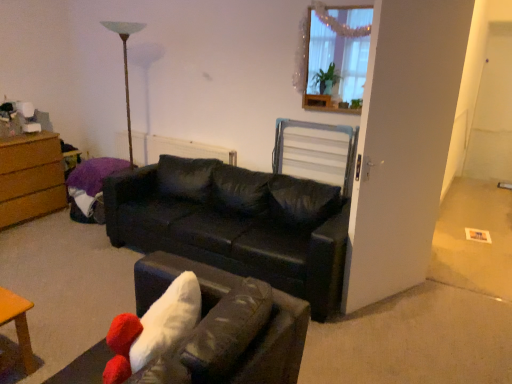
The width and height of the screenshot is (512, 384). What do you see at coordinates (334, 57) in the screenshot?
I see `wooden frame at upper right` at bounding box center [334, 57].

I want to click on white textured radiator at center, so click(x=175, y=149).

Looking at this image, measure the distance between point (274, 284) and camera.

Point (274, 284) is 8.61 feet from camera.

What do you see at coordinates (30, 177) in the screenshot?
I see `brown wood chest of drawers at left` at bounding box center [30, 177].

Image resolution: width=512 pixels, height=384 pixels. I want to click on metallic silver swivel chair at center, so click(315, 151).

Where is `wooden frame at upper right`? wooden frame at upper right is located at coordinates (334, 57).

Consider the image. Would you say white textured radiator at center contains wooden frame at upper right?

Actually, wooden frame at upper right is outside white textured radiator at center.

Between white textured radiator at center and wooden frame at upper right, which one has smaller size?

With smaller size is wooden frame at upper right.

Identify the location of window in front of the white textured radiator at center. Image resolution: width=512 pixels, height=384 pixels. (334, 57).

Are white textured radiator at center and wooden frame at upper right far apart?

Yes, white textured radiator at center and wooden frame at upper right are located far from each other.

From the image's perspective, which one is positioned lower, brown wood chest of drawers at left or metallic silver swivel chair at center?

brown wood chest of drawers at left appears lower in the image.

Based on the photo, based on their positions, is brown wood chest of drawers at left located to the left or right of metallic silver swivel chair at center?

brown wood chest of drawers at left is to the left of metallic silver swivel chair at center.

In the scene shown: Who is more distant, brown wood chest of drawers at left or metallic silver swivel chair at center?

brown wood chest of drawers at left is behind.

How distant is brown wood chest of drawers at left from metallic silver swivel chair at center?

The distance of brown wood chest of drawers at left from metallic silver swivel chair at center is 7.41 feet.

From the image's perspective, is metallic silver swivel chair at center above or below black leather couch at center, the 2th studio couch in the front-to-back sequence?

metallic silver swivel chair at center is situated higher than black leather couch at center, the 2th studio couch in the front-to-back sequence, in the image.

This screenshot has height=384, width=512. Identify the location of swivel chair that appears behind the black leather couch at center, the first studio couch viewed from the back. (315, 151).

Measure the distance from metallic silver swivel chair at center to black leather couch at center, the first studio couch viewed from the back.

metallic silver swivel chair at center is 27.36 inches away from black leather couch at center, the first studio couch viewed from the back.

You are a GUI agent. You are given a task and a screenshot of the screen. Output one action in this format:
    pyautogui.click(x=<x>, y=<y>)
    Task: Click on the studio couch that is the 1st object directly below the wooden frame at upper right (from a real-world perspective)
    The image size is (512, 384).
    Given the screenshot: What is the action you would take?
    pyautogui.click(x=273, y=346)

Are black leather couch at center, acting as the 2th studio couch starting from the back, and wooden frame at upper right far apart?

Indeed, black leather couch at center, acting as the 2th studio couch starting from the back, is not near wooden frame at upper right.

From a real-world perspective, which is physically below, black leather couch at center, the first studio couch from the front, or wooden frame at upper right?

black leather couch at center, the first studio couch from the front, is physically lower.

Which of these two, brown wood chest of drawers at left or wooden frame at upper right, is bigger?

With larger size is brown wood chest of drawers at left.

Is point (32, 173) more distant than point (343, 25)?

Yes, it is.

How many degrees apart are the facing directions of brown wood chest of drawers at left and wooden frame at upper right?

They differ by 93.6 degrees in their facing directions.

Which is correct: brown wood chest of drawers at left is inside wooden frame at upper right, or outside of it?

brown wood chest of drawers at left exists outside the volume of wooden frame at upper right.

From a real-world perspective, is metallic silver swivel chair at center above or below brown wood chest of drawers at left?

metallic silver swivel chair at center is above brown wood chest of drawers at left.

From the image's perspective, which one is positioned lower, metallic silver swivel chair at center or brown wood chest of drawers at left?

brown wood chest of drawers at left appears lower in the image.

What's the angular difference between metallic silver swivel chair at center and brown wood chest of drawers at left's facing directions?

The facing directions of metallic silver swivel chair at center and brown wood chest of drawers at left are 92.5 degrees apart.

Is black leather couch at center, the first studio couch viewed from the back, a part of brown wood chest of drawers at left?

Actually, black leather couch at center, the first studio couch viewed from the back, is outside brown wood chest of drawers at left.

Is brown wood chest of drawers at left facing towards black leather couch at center, the first studio couch viewed from the back?

Yes, brown wood chest of drawers at left faces towards black leather couch at center, the first studio couch viewed from the back.

In the scene shown: Is brown wood chest of drawers at left in contact with black leather couch at center, the 2th studio couch in the front-to-back sequence?

brown wood chest of drawers at left and black leather couch at center, the 2th studio couch in the front-to-back sequence, are not in contact.

In the image, is brown wood chest of drawers at left positioned in front of or behind black leather couch at center, the first studio couch viewed from the back?

In the image, brown wood chest of drawers at left appears behind black leather couch at center, the first studio couch viewed from the back.

You are a GUI agent. You are given a task and a screenshot of the screen. Output one action in this format:
    pyautogui.click(x=<x>, y=<y>)
    Task: Click on the window above the white textured radiator at center (from the image's perspective)
    
    Given the screenshot: What is the action you would take?
    coord(334,57)

Locate an element on the screen. The image size is (512, 384). chest of drawers behind the metallic silver swivel chair at center is located at coordinates (30, 177).

Looking at the image, which one is located further to brown wood chest of drawers at left, wooden frame at upper right or black leather couch at center, the first studio couch from the front?

The object further to brown wood chest of drawers at left is wooden frame at upper right.

When comparing their distances from metallic silver swivel chair at center, does white textured radiator at center or wooden frame at upper right seem closer?

wooden frame at upper right.

Estimate the real-world distances between objects in this image. Which object is closer to wooden frame at upper right, black leather couch at center, the first studio couch from the front, or black leather couch at center, the first studio couch viewed from the back?

Among the two, black leather couch at center, the first studio couch viewed from the back, is located nearer to wooden frame at upper right.

From the image, which object appears to be farther from black leather couch at center, the first studio couch from the front, white textured radiator at center or black leather couch at center, the first studio couch viewed from the back?

white textured radiator at center lies further to black leather couch at center, the first studio couch from the front, than the other object.

Based on their spatial positions, is wooden frame at upper right or metallic silver swivel chair at center closer to brown wood chest of drawers at left?

metallic silver swivel chair at center.

Looking at the image, which one is located closer to white textured radiator at center, metallic silver swivel chair at center or wooden frame at upper right?

Based on the image, metallic silver swivel chair at center appears to be nearer to white textured radiator at center.

Based on their spatial positions, is black leather couch at center, the first studio couch viewed from the back, or metallic silver swivel chair at center further from white textured radiator at center?

Among the two, metallic silver swivel chair at center is located further to white textured radiator at center.

Estimate the real-world distances between objects in this image. Which object is further from black leather couch at center, the 2th studio couch in the front-to-back sequence, white textured radiator at center or black leather couch at center, acting as the 2th studio couch starting from the back?

black leather couch at center, acting as the 2th studio couch starting from the back, is positioned further to the anchor black leather couch at center, the 2th studio couch in the front-to-back sequence.

Where is `radiator between brown wood chest of drawers at left and metallic silver swivel chair at center`? This screenshot has height=384, width=512. radiator between brown wood chest of drawers at left and metallic silver swivel chair at center is located at coordinates (175, 149).

The height and width of the screenshot is (384, 512). I want to click on swivel chair that lies between wooden frame at upper right and black leather couch at center, the 2th studio couch in the front-to-back sequence, from top to bottom, so click(x=315, y=151).

This screenshot has width=512, height=384. What are the coordinates of `window positioned between black leather couch at center, acting as the 2th studio couch starting from the back, and metallic silver swivel chair at center from near to far` in the screenshot? It's located at (334, 57).

The width and height of the screenshot is (512, 384). I want to click on studio couch between black leather couch at center, acting as the 2th studio couch starting from the back, and wooden frame at upper right, along the z-axis, so click(x=234, y=224).